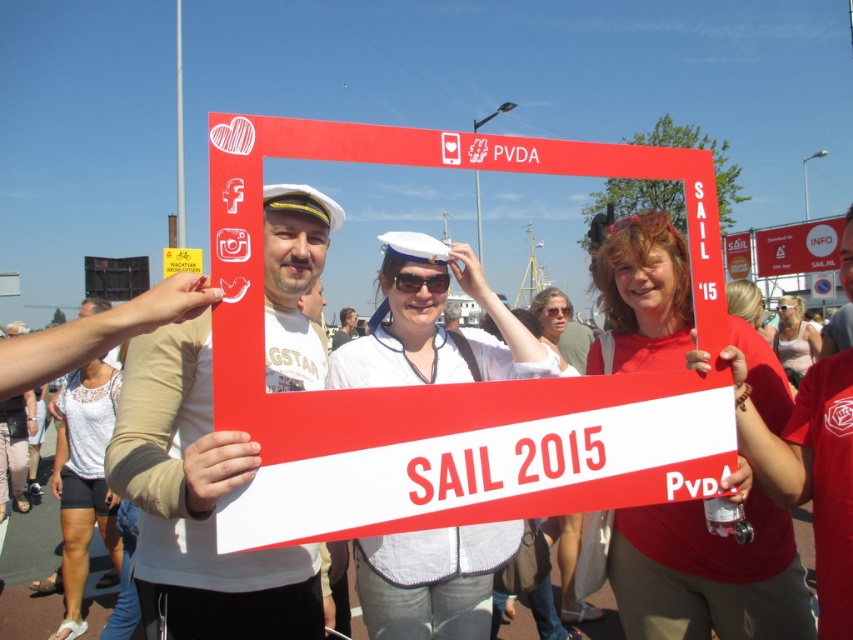
Question: Is matte red shirt at center below transparent plastic goggles at center?

Choices:
 (A) yes
 (B) no

Answer: (A)

Question: Does matte white sailor hat at left have a greater width compared to white lace tank top at lower left?

Choices:
 (A) no
 (B) yes

Answer: (A)

Question: Which point appears farthest from the camera in this image?

Choices:
 (A) (683, 627)
 (B) (837, 256)
 (C) (733, 301)
 (D) (439, 275)

Answer: (B)

Question: Does matte white sailor hat at center come behind white lace tank top at lower left?

Choices:
 (A) no
 (B) yes

Answer: (A)

Question: Which point is closer to the camera?

Choices:
 (A) matte white sailor hat at left
 (B) matte white sailor hat at center
 (C) matte white blouse at center
 (D) black plastic goggles at center

Answer: (A)

Question: Based on their relative distances, which object is nearer to the matte red shirt at center?

Choices:
 (A) transparent plastic goggles at upper center
 (B) black plastic goggles at center
 (C) matte white sailor hat at center
 (D) matte white sailor hat at left

Answer: (C)